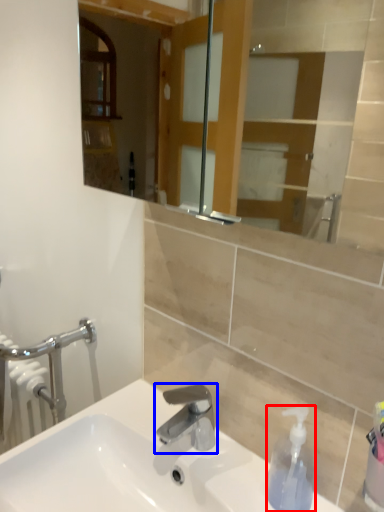
Question: Which point is further to the camera, soap dispenser (highlighted by a red box) or tap (highlighted by a blue box)?

Choices:
 (A) soap dispenser
 (B) tap

Answer: (B)